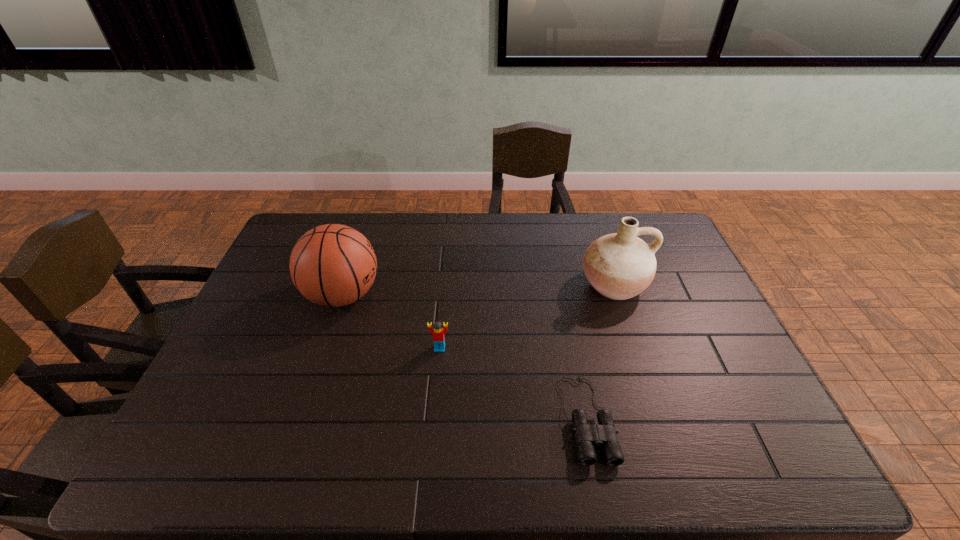
Where is `object situated at the left edge`? The width and height of the screenshot is (960, 540). object situated at the left edge is located at coordinates (333, 265).

Locate an element on the screen. The image size is (960, 540). vacant space at the far edge of the desktop is located at coordinates (523, 219).

This screenshot has width=960, height=540. Identify the location of free space at the near edge. (258, 464).

Where is `vacant space at the left edge`? This screenshot has width=960, height=540. vacant space at the left edge is located at coordinates (269, 288).

At what (x,y) coordinates should I click in order to perform the action: click on vacant position at the right edge of the desktop. Please return your answer as a coordinate pair (x, y). Looking at the image, I should click on (655, 285).

Image resolution: width=960 pixels, height=540 pixels. Find the location of `empty space between the second shortest object and the shortest object`. empty space between the second shortest object and the shortest object is located at coordinates (514, 383).

You are a GUI agent. You are given a task and a screenshot of the screen. Output one action in this format:
    pyautogui.click(x=<x>, y=<y>)
    Task: Click on the vacant area that lies between the basketball and the pottery
    The image size is (960, 540).
    Given the screenshot: What is the action you would take?
    pyautogui.click(x=478, y=290)

Locate an element on the screen. Image resolution: width=960 pixels, height=540 pixels. vacant area that lies between the binoculars and the second nearest object is located at coordinates (514, 383).

The height and width of the screenshot is (540, 960). Find the location of `free spot between the basketball and the pottery`. free spot between the basketball and the pottery is located at coordinates (478, 290).

Image resolution: width=960 pixels, height=540 pixels. What are the coordinates of `free point between the basketball and the second object from right to left` in the screenshot? It's located at (465, 357).